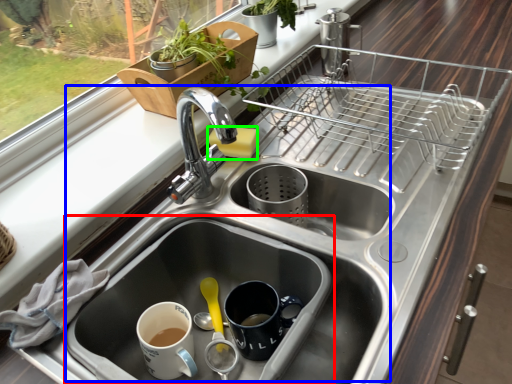
Question: Estimate the real-world distances between objects in this image. Which object is farther from sink (highlighted by a red box), sink (highlighted by a blue box) or soap (highlighted by a green box)?

Choices:
 (A) sink
 (B) soap

Answer: (B)